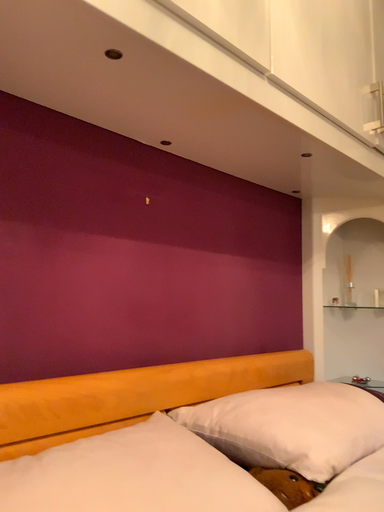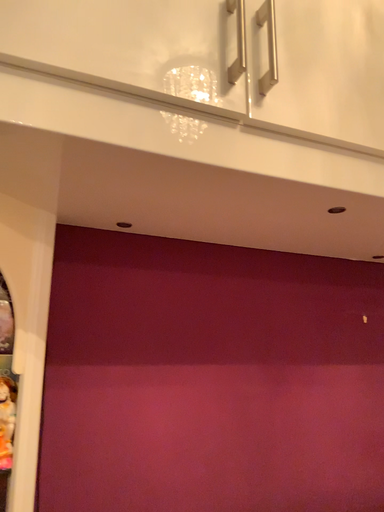
Question: How did the camera likely rotate when shooting the video?

Choices:
 (A) rotated upward
 (B) rotated downward

Answer: (A)